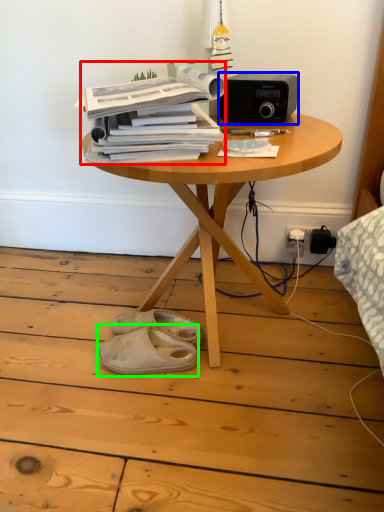
Question: Which is nearer to the paperback book (highlighted by a red box)? stereo (highlighted by a blue box) or footwear (highlighted by a green box).

Choices:
 (A) stereo
 (B) footwear

Answer: (A)